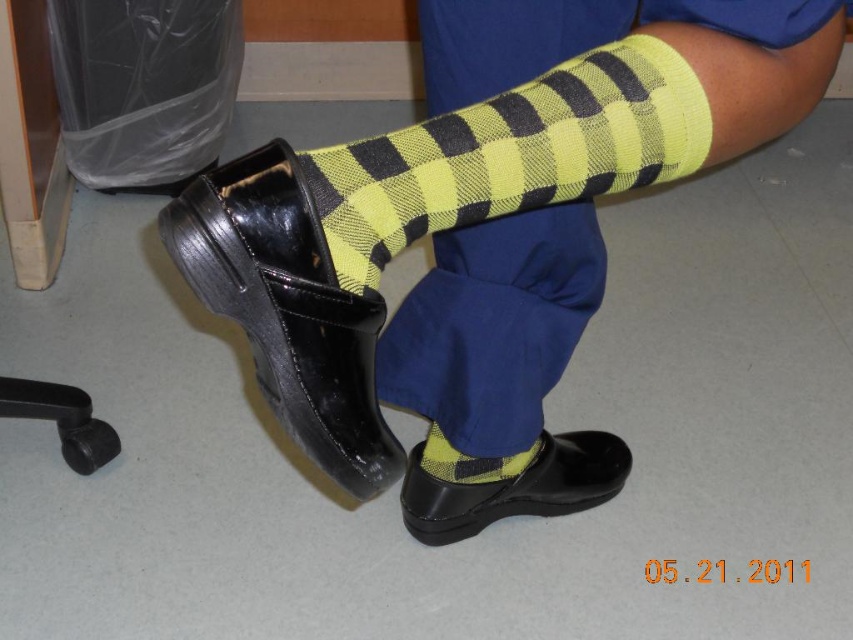
Can you confirm if yellow checkered sock at center is thinner than yellow/black checkered sock at center?

Incorrect, yellow checkered sock at center's width is not less than yellow/black checkered sock at center's.

Between point (495, 264) and point (450, 179), which one is positioned behind?

Point (495, 264)

Identify the location of yellow checkered sock at center. This screenshot has height=640, width=853. click(x=494, y=324).

Who is more forward, (492, 362) or (424, 444)?

Point (492, 362) is in front.

Is yellow checkered sock at center to the right of yellow checkered sock at lower center from the viewer's perspective?

Indeed, yellow checkered sock at center is positioned on the right side of yellow checkered sock at lower center.

Is point (544, 221) in front of point (492, 477)?

That is True.

What are the coordinates of `yellow checkered sock at center` in the screenshot? It's located at (494, 324).

Between yellow/black checkered sock at center and black rubber heel at lower left, which one is positioned higher?

Positioned higher is yellow/black checkered sock at center.

Describe the element at coordinates (512, 154) in the screenshot. I see `yellow/black checkered sock at center` at that location.

I want to click on yellow/black checkered sock at center, so coord(512,154).